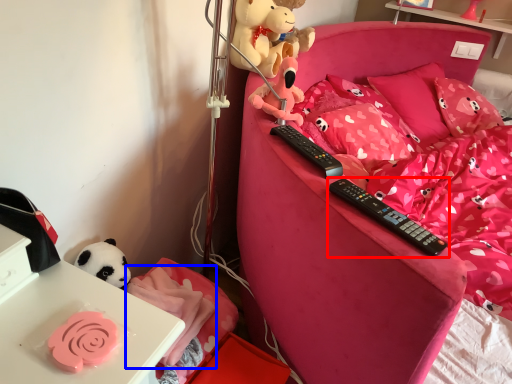
Question: Which point is further to the camera, remote control (highlighted by a red box) or blanket (highlighted by a blue box)?

Choices:
 (A) remote control
 (B) blanket

Answer: (B)